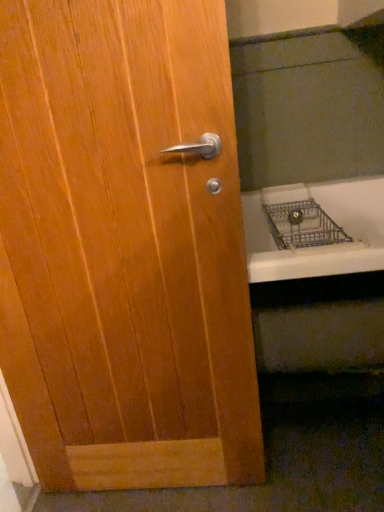
Question: Could metallic silver bath at lower right be considered to be inside wooden door at center?

Choices:
 (A) no
 (B) yes

Answer: (A)

Question: From the image's perspective, is wooden door at center located above metallic silver bath at lower right?

Choices:
 (A) yes
 (B) no

Answer: (B)

Question: From a real-world perspective, is wooden door at center on metallic silver bath at lower right?

Choices:
 (A) yes
 (B) no

Answer: (A)

Question: Considering the relative positions of wooden door at center and metallic silver bath at lower right in the image provided, is wooden door at center behind metallic silver bath at lower right?

Choices:
 (A) yes
 (B) no

Answer: (B)

Question: From the image's perspective, does wooden door at center appear lower than metallic silver bath at lower right?

Choices:
 (A) yes
 (B) no

Answer: (A)

Question: Can you confirm if wooden door at center is bigger than metallic silver bath at lower right?

Choices:
 (A) yes
 (B) no

Answer: (A)

Question: Does metallic silver bath at lower right turn towards wooden door at center?

Choices:
 (A) no
 (B) yes

Answer: (A)

Question: From the image's perspective, is metallic silver bath at lower right above wooden door at center?

Choices:
 (A) no
 (B) yes

Answer: (B)

Question: Is metallic silver bath at lower right bigger than wooden door at center?

Choices:
 (A) yes
 (B) no

Answer: (B)

Question: From the image's perspective, is metallic silver bath at lower right under wooden door at center?

Choices:
 (A) no
 (B) yes

Answer: (A)

Question: Does metallic silver bath at lower right have a greater width compared to wooden door at center?

Choices:
 (A) yes
 (B) no

Answer: (A)

Question: Would you say metallic silver bath at lower right contains wooden door at center?

Choices:
 (A) yes
 (B) no

Answer: (B)

Question: Considering the positions of metallic silver bath at lower right and wooden door at center in the image, is metallic silver bath at lower right taller or shorter than wooden door at center?

Choices:
 (A) tall
 (B) short

Answer: (B)